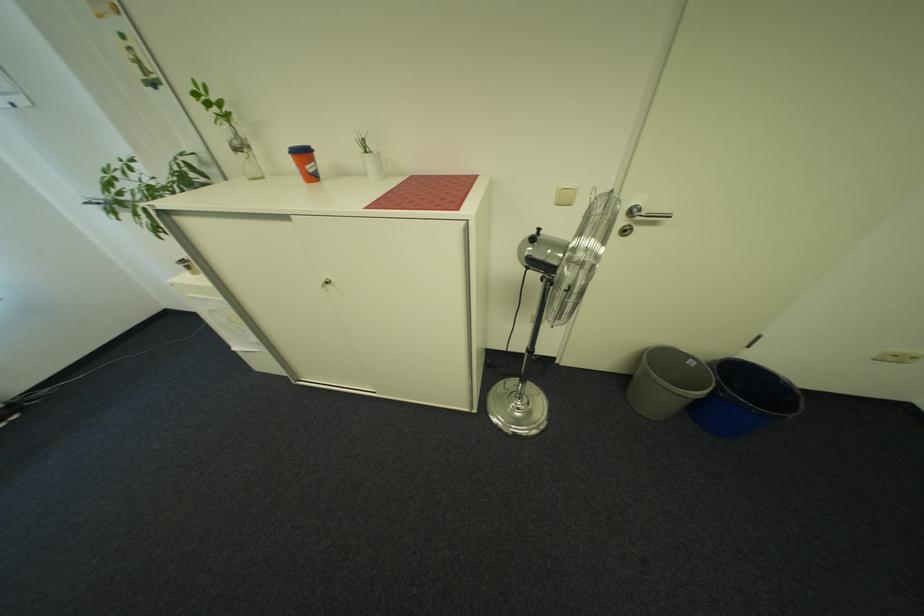
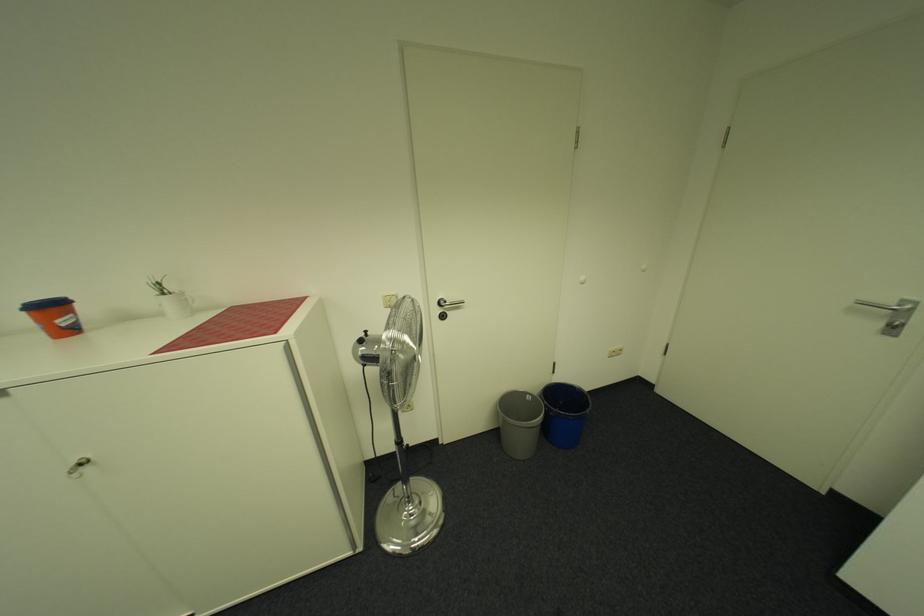
The point at (321, 172) is marked in the first image. Where is the corresponding point in the second image?

(73, 326)